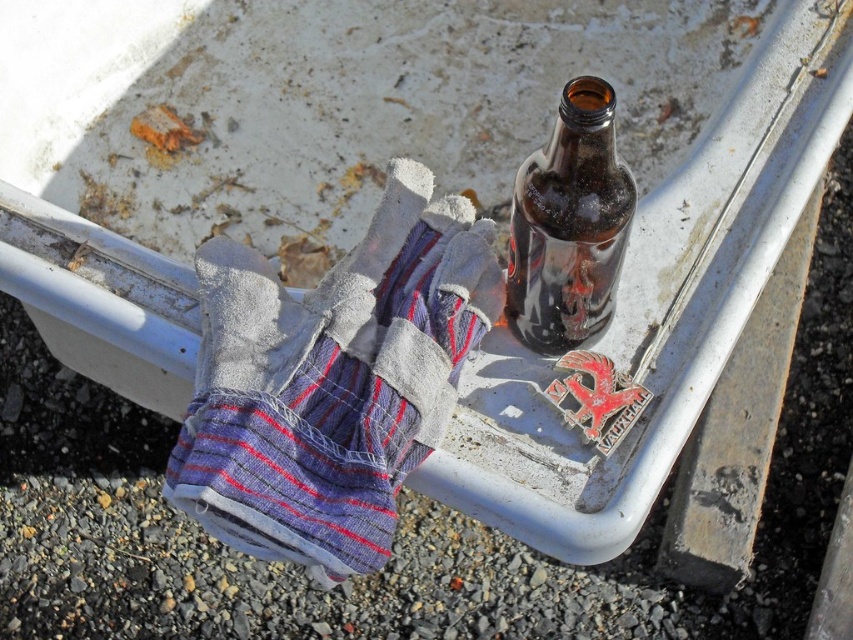
Who is shorter, worn fabric glove at center or brown glass bottle at center?

brown glass bottle at center

Is worn fabric glove at center further to camera compared to brown glass bottle at center?

Yes, it is.

Where is `worn fabric glove at center`? The image size is (853, 640). worn fabric glove at center is located at coordinates 300,465.

The image size is (853, 640). I want to click on worn fabric glove at center, so click(x=300, y=465).